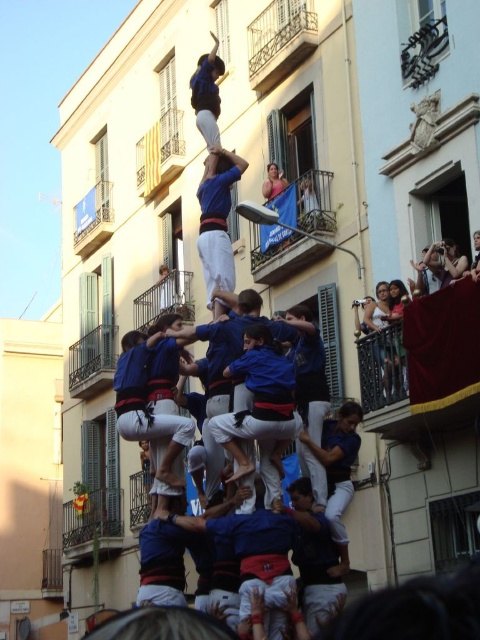
Question: Does metallic railing at upper center lie behind blue fabric at center?

Choices:
 (A) no
 (B) yes

Answer: (B)

Question: Which object is the closest to the matte blue shirt at upper center?

Choices:
 (A) metallic railing at upper center
 (B) blue fabric at center

Answer: (B)

Question: Considering the relative positions of metallic railing at upper center and matte blue shirt at upper center in the image provided, where is metallic railing at upper center located with respect to matte blue shirt at upper center?

Choices:
 (A) below
 (B) above

Answer: (B)

Question: Where is metallic railing at upper center located in relation to blue fabric at center in the image?

Choices:
 (A) right
 (B) left

Answer: (A)

Question: Which of the following is the closest to the observer?

Choices:
 (A) (287, 8)
 (B) (215, 60)
 (C) (203, 209)

Answer: (C)

Question: Which point appears closest to the camera in this image?

Choices:
 (A) (278, 81)
 (B) (226, 173)

Answer: (B)